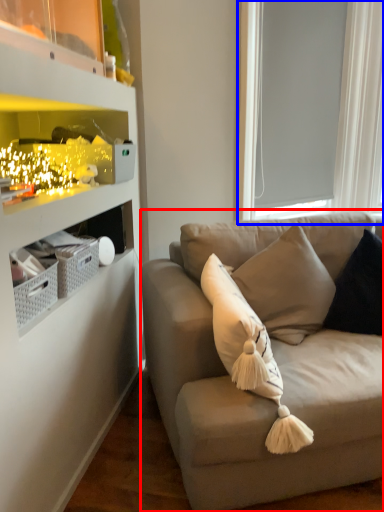
Question: Among these objects, which one is farthest to the camera, studio couch (highlighted by a red box) or window screen (highlighted by a blue box)?

Choices:
 (A) studio couch
 (B) window screen

Answer: (B)